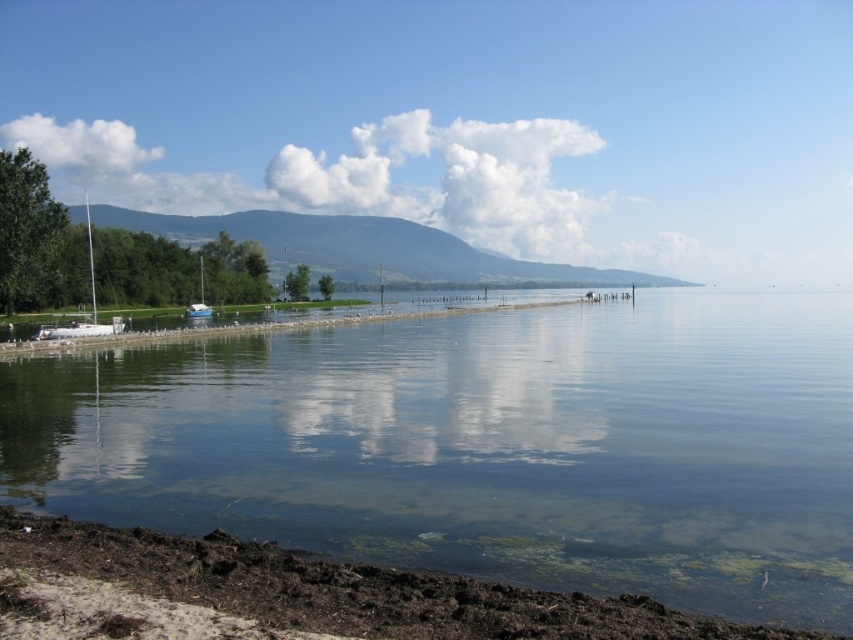
Does brown dirt at lower left appear on the left side of white matte sailboat at left?

In fact, brown dirt at lower left is to the right of white matte sailboat at left.

Which is in front, point (653, 611) or point (111, 330)?

Point (653, 611) is in front.

Where is `brown dirt at lower left`? brown dirt at lower left is located at coordinates (345, 589).

At what (x,y) coordinates should I click in order to perform the action: click on brown dirt at lower left. Please return your answer as a coordinate pair (x, y). Image resolution: width=853 pixels, height=640 pixels. Looking at the image, I should click on (345, 589).

Does clear water at lower left appear on the right side of brown dirt at lower left?

Yes, clear water at lower left is to the right of brown dirt at lower left.

Where is `clear water at lower left`? The image size is (853, 640). clear water at lower left is located at coordinates (485, 445).

Between white matte sailboat at left and white glossy sailboat at center-left, which one is positioned higher?

white matte sailboat at left is higher up.

Is white matte sailboat at left shorter than white glossy sailboat at center-left?

No.

Which is in front, point (90, 216) or point (201, 257)?

Point (201, 257) is more forward.

Where is `white matte sailboat at left`? The image size is (853, 640). white matte sailboat at left is located at coordinates (82, 310).